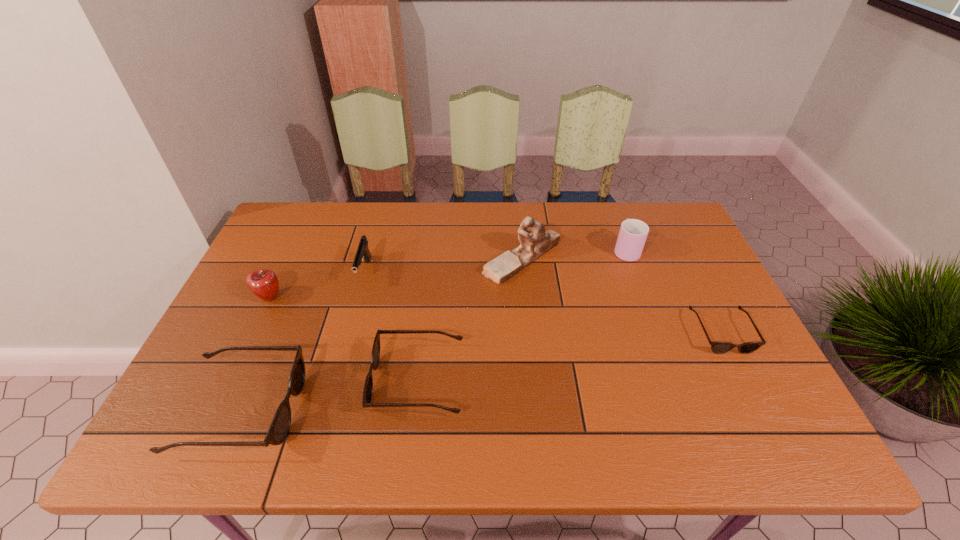
If equal spacing is desired by inserting an extra sunglasses among them, please point out a free spot for this new sunglasses. Please provide its 2D coordinates. Your answer should be formatted as a tuple, i.e. [(x, y)], where the tuple contains the x and y coordinates of a point satisfying the conditions above.

[(577, 355)]